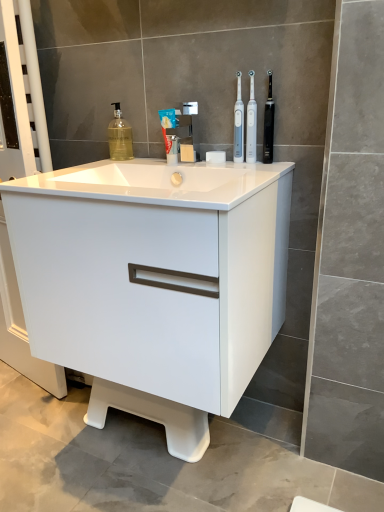
Question: From a real-world perspective, does blue matte toothpaste at center sit lower than white plastic toothbrush at upper center, marked as the 2th toothbrush in a left-to-right arrangement?

Choices:
 (A) no
 (B) yes

Answer: (B)

Question: Is the depth of blue matte toothpaste at center greater than that of white plastic toothbrush at upper center, acting as the 2th toothbrush starting from the right?

Choices:
 (A) no
 (B) yes

Answer: (B)

Question: Is white plastic toothbrush at upper center, acting as the 2th toothbrush starting from the right, located within blue matte toothpaste at center?

Choices:
 (A) no
 (B) yes

Answer: (A)

Question: Considering the relative sizes of blue matte toothpaste at center and white plastic toothbrush at upper center, acting as the 2th toothbrush starting from the right, in the image provided, is blue matte toothpaste at center wider than white plastic toothbrush at upper center, acting as the 2th toothbrush starting from the right,?

Choices:
 (A) no
 (B) yes

Answer: (B)

Question: From the image's perspective, does blue matte toothpaste at center appear lower than white plastic toothbrush at upper center, marked as the 2th toothbrush in a left-to-right arrangement?

Choices:
 (A) yes
 (B) no

Answer: (A)

Question: Choose the correct answer: Is white plastic toothbrush at upper center, marked as the 2th toothbrush in a left-to-right arrangement, inside white glossy sink at center or outside it?

Choices:
 (A) inside
 (B) outside

Answer: (B)

Question: Visually, is white plastic toothbrush at upper center, marked as the 2th toothbrush in a left-to-right arrangement, positioned to the left or to the right of white glossy sink at center?

Choices:
 (A) right
 (B) left

Answer: (A)

Question: Looking at their shapes, would you say white plastic toothbrush at upper center, marked as the 2th toothbrush in a left-to-right arrangement, is wider or thinner than white glossy sink at center?

Choices:
 (A) thin
 (B) wide

Answer: (A)

Question: Based on their sizes in the image, would you say white plastic toothbrush at upper center, acting as the 2th toothbrush starting from the right, is bigger or smaller than white glossy sink at center?

Choices:
 (A) small
 (B) big

Answer: (A)

Question: Considering the positions of white plastic toothbrush at center, which appears as the 3th toothbrush when viewed from the right, and white glossy sink at center in the image, is white plastic toothbrush at center, which appears as the 3th toothbrush when viewed from the right, bigger or smaller than white glossy sink at center?

Choices:
 (A) big
 (B) small

Answer: (B)

Question: From a real-world perspective, is white plastic toothbrush at center, which appears as the 3th toothbrush when viewed from the right, above or below white glossy sink at center?

Choices:
 (A) above
 (B) below

Answer: (A)

Question: In terms of height, does white plastic toothbrush at center, which appears as the 3th toothbrush when viewed from the right, look taller or shorter compared to white glossy sink at center?

Choices:
 (A) short
 (B) tall

Answer: (B)

Question: Relative to white glossy sink at center, is white plastic toothbrush at center, the first toothbrush from the left, in front or behind?

Choices:
 (A) front
 (B) behind

Answer: (B)

Question: Does point (173, 120) appear closer or farther from the camera than point (236, 124)?

Choices:
 (A) closer
 (B) farther

Answer: (B)

Question: Is blue matte toothpaste at center taller or shorter than white plastic toothbrush at center, which appears as the 3th toothbrush when viewed from the right?

Choices:
 (A) short
 (B) tall

Answer: (A)